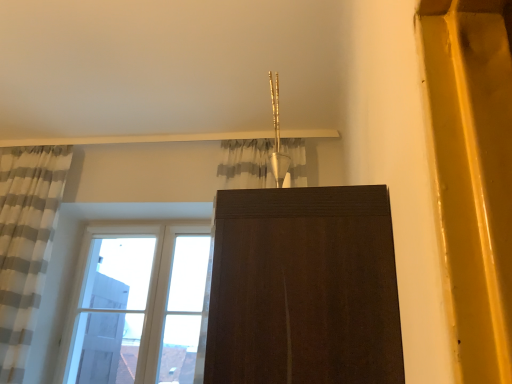
Question: From the image's perspective, is white striped fabric at left located beneath clear glass window at lower left?

Choices:
 (A) yes
 (B) no

Answer: (B)

Question: Is white striped fabric at left at the left side of clear glass window at lower left?

Choices:
 (A) yes
 (B) no

Answer: (A)

Question: Is white striped fabric at left closer to the viewer compared to clear glass window at lower left?

Choices:
 (A) no
 (B) yes

Answer: (B)

Question: Can you confirm if white striped fabric at left is shorter than clear glass window at lower left?

Choices:
 (A) no
 (B) yes

Answer: (A)

Question: Is clear glass window at lower left completely or partially inside white striped fabric at left?

Choices:
 (A) no
 (B) yes

Answer: (A)

Question: Is white striped fabric at left next to clear glass window at lower left and touching it?

Choices:
 (A) yes
 (B) no

Answer: (B)

Question: Can you confirm if clear glass window at lower left is smaller than white striped fabric at left?

Choices:
 (A) yes
 (B) no

Answer: (A)

Question: Is clear glass window at lower left facing away from white striped fabric at left?

Choices:
 (A) no
 (B) yes

Answer: (A)

Question: Is clear glass window at lower left closer to camera compared to white striped fabric at left?

Choices:
 (A) yes
 (B) no

Answer: (B)

Question: From a real-world perspective, is clear glass window at lower left on top of white striped fabric at left?

Choices:
 (A) yes
 (B) no

Answer: (B)

Question: Is clear glass window at lower left at the left side of white striped fabric at left?

Choices:
 (A) no
 (B) yes

Answer: (A)

Question: Are clear glass window at lower left and white striped fabric at left far apart?

Choices:
 (A) no
 (B) yes

Answer: (A)

Question: Considering the positions of white striped fabric at left and clear glass window at lower left in the image, is white striped fabric at left wider or thinner than clear glass window at lower left?

Choices:
 (A) wide
 (B) thin

Answer: (A)